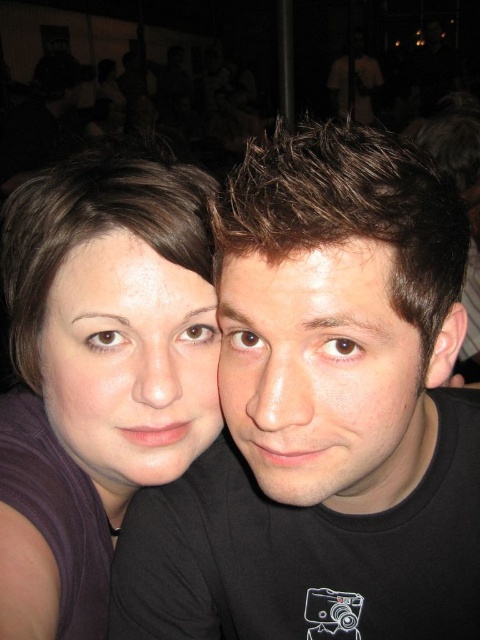
Which is behind, point (314, 605) or point (376, 252)?

Point (314, 605)

Who is more forward, (433, 252) or (302, 301)?

Point (302, 301)

Identify the location of black matte shirt at center. (x=324, y=413).

You are a GUI agent. You are given a task and a screenshot of the screen. Output one action in this format:
    pyautogui.click(x=<x>, y=<y>)
    Task: Click on the matte skin face at left
    
    Given the screenshot: What is the action you would take?
    (130, 362)

Between matte skin face at left and matte brown hair at center, which one appears on the left side from the viewer's perspective?

Positioned to the left is matte skin face at left.

Who is more forward, [163,289] or [317,269]?

Point [317,269]

Locate an element on the screen. The image size is (480, 640). matte skin face at left is located at coordinates (130, 362).

Is black matte shirt at center to the right of matte purple shirt at left from the viewer's perspective?

Indeed, black matte shirt at center is positioned on the right side of matte purple shirt at left.

What do you see at coordinates (324, 413) in the screenshot? I see `black matte shirt at center` at bounding box center [324, 413].

The image size is (480, 640). What are the coordinates of `black matte shirt at center` in the screenshot? It's located at pyautogui.click(x=324, y=413).